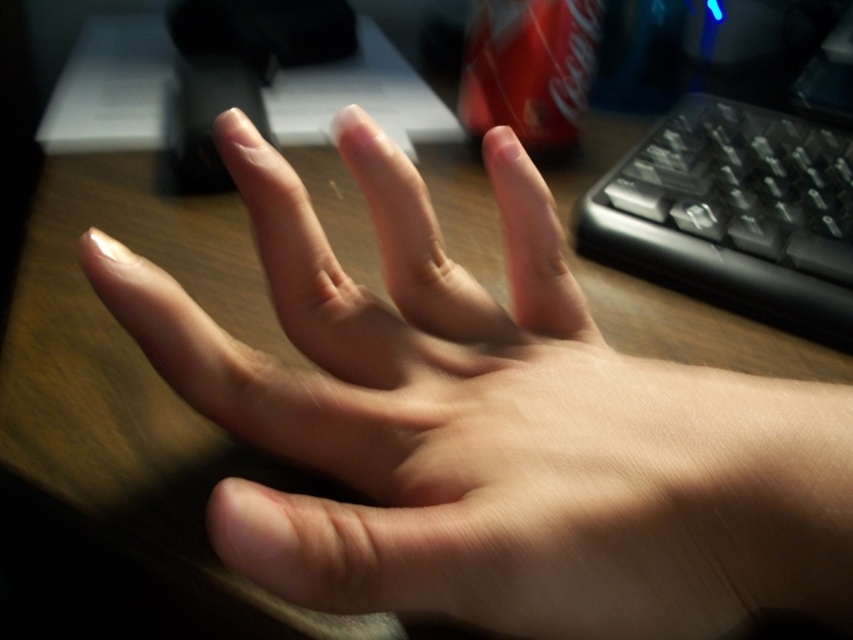
Question: Which object appears farthest from the camera in this image?

Choices:
 (A) black plastic keyboard at right
 (B) matte red can at upper center

Answer: (B)

Question: Among these objects, which one is nearest to the camera?

Choices:
 (A) matte red can at upper center
 (B) black plastic keyboard at right

Answer: (B)

Question: Can you confirm if black plastic keyboard at right is smaller than matte red can at upper center?

Choices:
 (A) no
 (B) yes

Answer: (A)

Question: Is black plastic keyboard at right bigger than matte red can at upper center?

Choices:
 (A) yes
 (B) no

Answer: (A)

Question: Is black plastic keyboard at right smaller than matte red can at upper center?

Choices:
 (A) no
 (B) yes

Answer: (A)